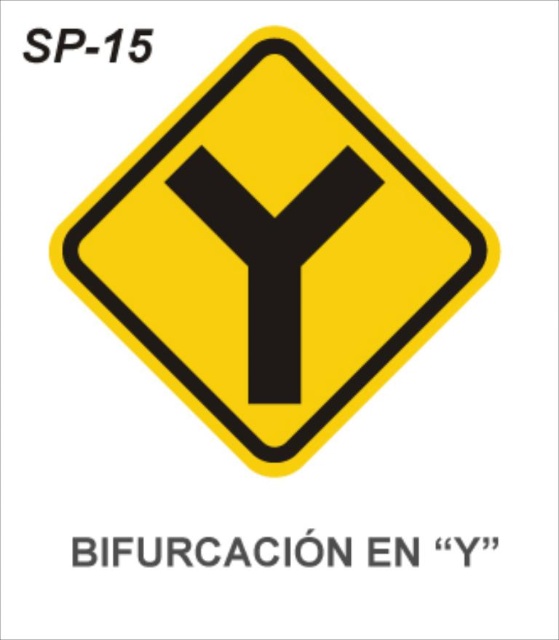
You are a driver approaching a road sign and see the yellow matte diamond at center and the black matte arrow at center. Which object do you think is bigger?

The yellow matte diamond at center is larger than the black matte arrow at center.

You are a driver approaching a traffic sign and notice two elements on it. One is the yellow matte diamond at center and the other is the black matte arrow at center. Which element appears closer to you?

The yellow matte diamond at center appears closer to you because it is positioned in front of the black matte arrow at center.